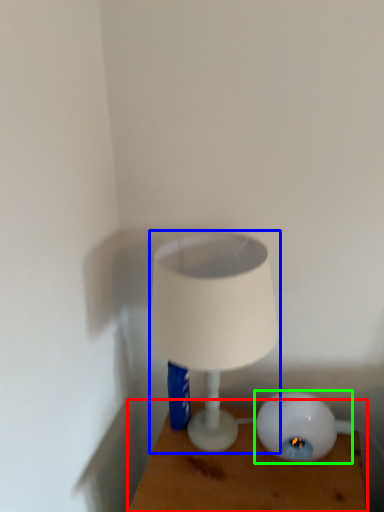
Question: Based on their relative distances, which object is nearer to furniture (highlighted by a red box)? Choose from lamp (highlighted by a blue box) and lamp (highlighted by a green box).

Choices:
 (A) lamp
 (B) lamp

Answer: (B)